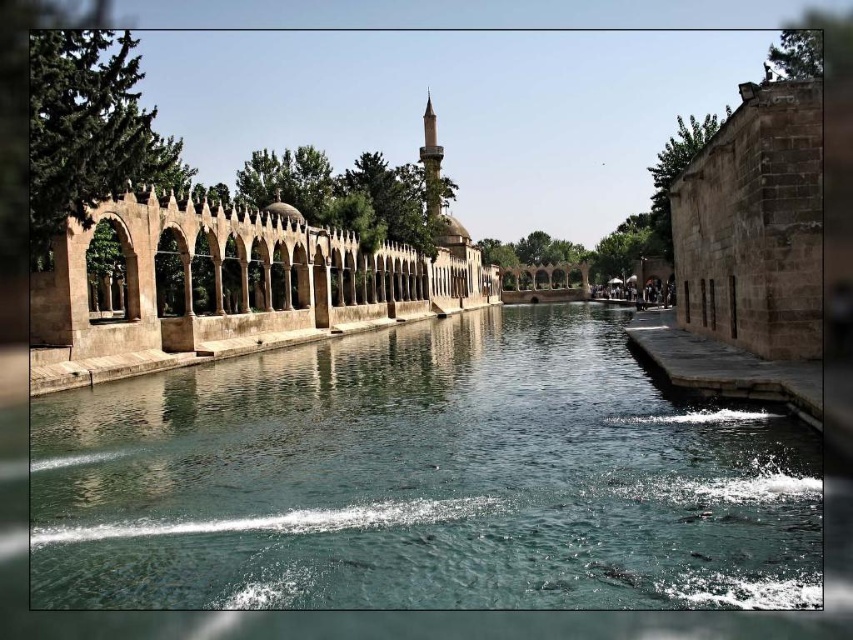
You are standing on the dock and see the clear stone water at center and the brown stone palace at center. Which object is located below the other?

The clear stone water at center is positioned under brown stone palace at center, so the clear stone water is below the brown stone palace.